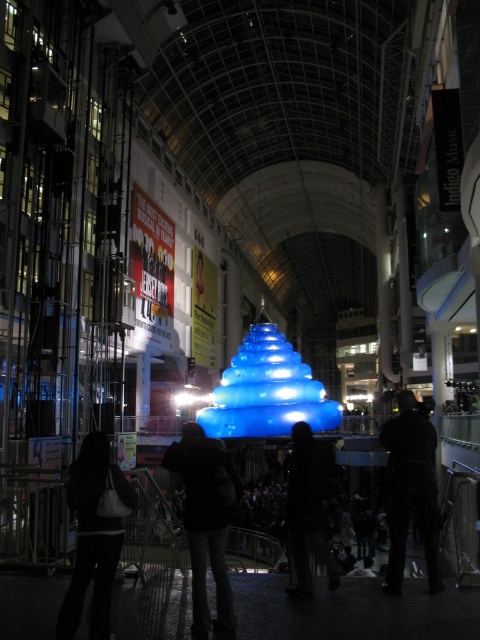
Question: Can you confirm if black fabric jacket at center is positioned to the right of black matte jacket at center?

Choices:
 (A) yes
 (B) no

Answer: (B)

Question: Which of the following is the closest to the observer?

Choices:
 (A) black fabric bag at lower left
 (B) black fabric jacket at center
 (C) silhouette coat at center
 (D) black matte jacket at center

Answer: (A)

Question: Does black fabric jacket at center come in front of black matte jacket at center?

Choices:
 (A) yes
 (B) no

Answer: (A)

Question: Considering the real-world distances, which object is closest to the black matte jacket at center?

Choices:
 (A) black fabric jacket at center
 (B) silhouette coat at center

Answer: (B)

Question: Can you confirm if black fabric jacket at center is smaller than black fabric bag at lower left?

Choices:
 (A) no
 (B) yes

Answer: (A)

Question: Which point is farther to the camera?

Choices:
 (A) black fabric jacket at center
 (B) black fabric bag at lower left

Answer: (A)